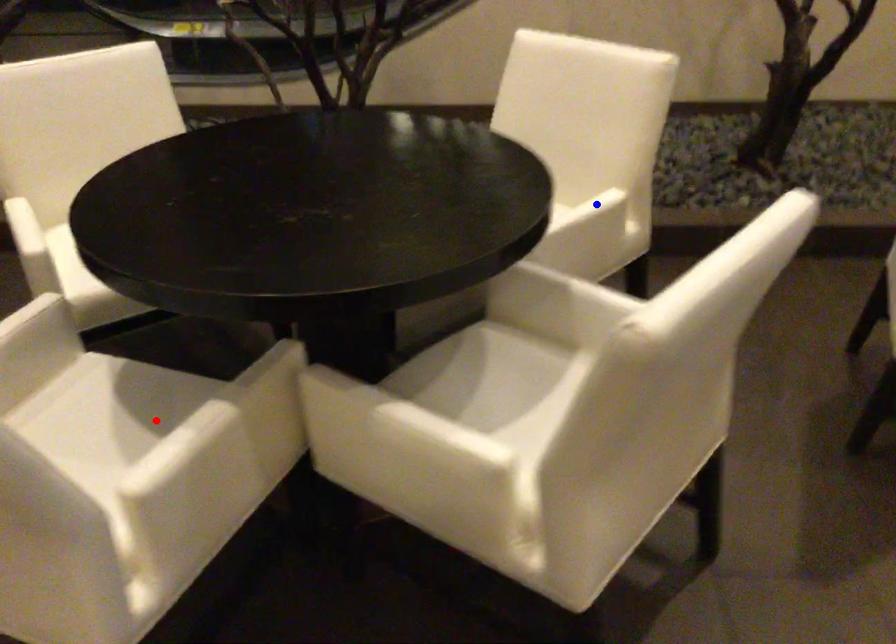
Question: In the image, two points are highlighted. Which point is nearer to the camera? Reply with the corresponding letter.

Choices:
 (A) blue point
 (B) red point

Answer: (B)